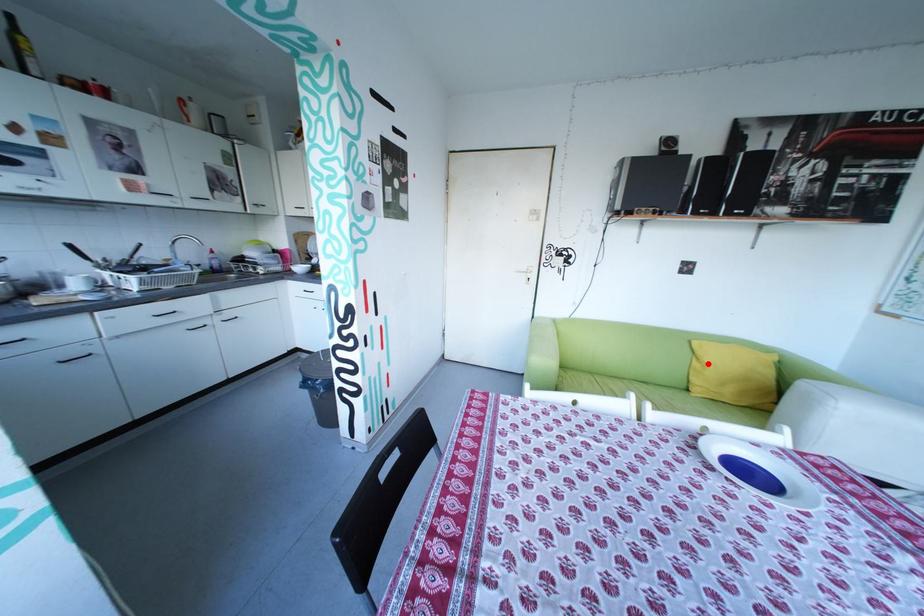
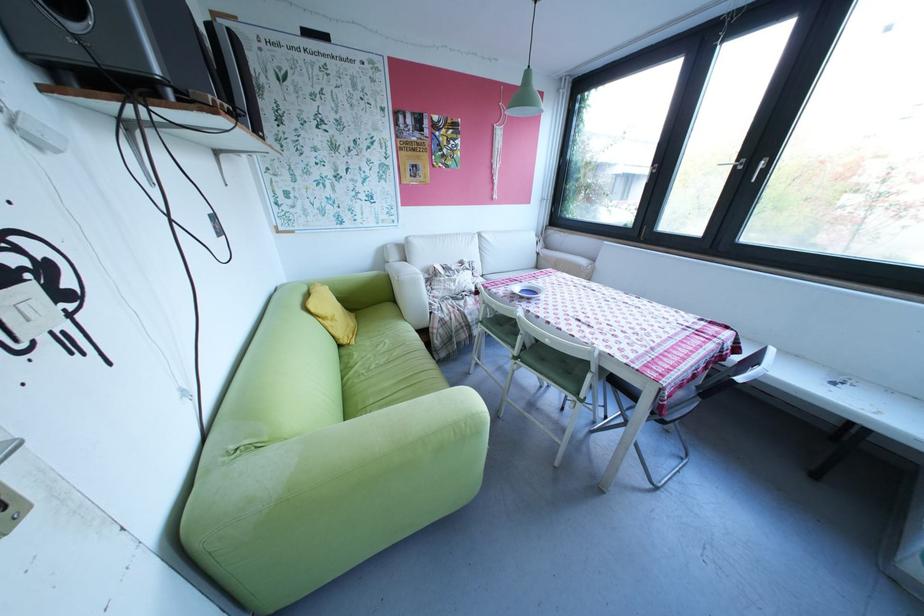
Question: I am providing you with two images of the same scene from different viewpoints. A red point is shown in image1. For the corresponding object point in image2, is it positioned nearer or farther from the camera?

Choices:
 (A) Nearer
 (B) Farther

Answer: (A)